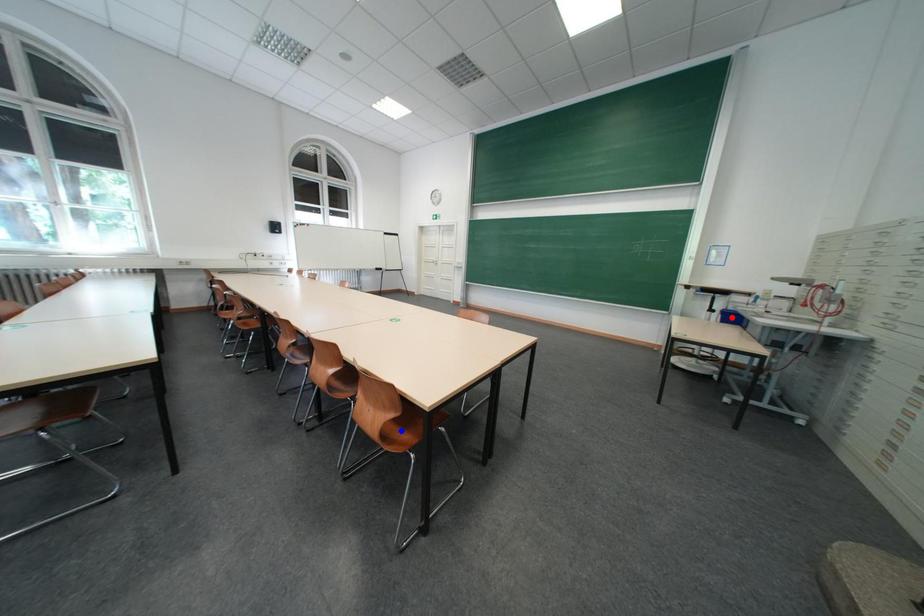
Question: Two points are marked on the image. Which point is closer to the camera?

Choices:
 (A) Blue point is closer.
 (B) Red point is closer.

Answer: (A)